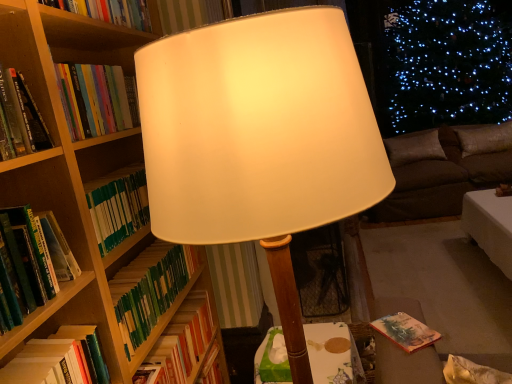
Describe the element at coordinates (333, 355) in the screenshot. I see `wooden table at center` at that location.

Identify the location of green hardcover book at left, which is the 2th book from top to bottom. (27, 255).

The width and height of the screenshot is (512, 384). What are the coordinates of `brown suede pillow at right, arranged as the 2th pillow when viewed from the right` in the screenshot? It's located at (414, 148).

The height and width of the screenshot is (384, 512). What do you see at coordinates (182, 343) in the screenshot?
I see `green matte book at left, which ranks as the 1th book in bottom-to-top order` at bounding box center [182, 343].

The height and width of the screenshot is (384, 512). What do you see at coordinates (260, 139) in the screenshot?
I see `matte white lampshade at center` at bounding box center [260, 139].

At what (x,y) coordinates should I click in order to perform the action: click on wooden table at center. Please return your answer as a coordinate pair (x, y). Looking at the image, I should click on (333, 355).

From the picture: Looking at their sizes, would you say brown fabric pillow at right, the first pillow positioned from the right, is wider or thinner than dark brown fabric couch at right?

Clearly, brown fabric pillow at right, the first pillow positioned from the right, has less width compared to dark brown fabric couch at right.

Which of these two, brown fabric pillow at right, the first pillow positioned from the right, or dark brown fabric couch at right, stands shorter?

With less height is brown fabric pillow at right, the first pillow positioned from the right.

From the image's perspective, between brown fabric pillow at right, marked as the 2th pillow in a left-to-right arrangement, and dark brown fabric couch at right, who is located below?

dark brown fabric couch at right, from the image's perspective.

Does brown suede pillow at right, arranged as the 2th pillow when viewed from the right, touch brown fabric pillow at right, marked as the 2th pillow in a left-to-right arrangement?

They are not placed beside each other.

Consider the image. From their relative heights in the image, would you say brown suede pillow at right, placed as the first pillow when sorted from left to right, is taller or shorter than brown fabric pillow at right, marked as the 2th pillow in a left-to-right arrangement?

Considering their sizes, brown suede pillow at right, placed as the first pillow when sorted from left to right, has more height than brown fabric pillow at right, marked as the 2th pillow in a left-to-right arrangement.

Identify the location of pillow on the right of brown suede pillow at right, arranged as the 2th pillow when viewed from the right. The width and height of the screenshot is (512, 384). (485, 139).

Which of these two, brown suede pillow at right, arranged as the 2th pillow when viewed from the right, or brown fabric pillow at right, the first pillow positioned from the right, is bigger?

With larger size is brown suede pillow at right, arranged as the 2th pillow when viewed from the right.

Is hardcover book at left, the 3th book viewed from the top, placed right next to hardcover book at upper left, which is the first book in top-to-bottom order?

No, hardcover book at left, the 3th book viewed from the top, is not in contact with hardcover book at upper left, which is the first book in top-to-bottom order.

Where is `the 2nd book below the hardcover book at upper left, the 4th book in the bottom-to-top sequence (from the image's perspective)`? the 2nd book below the hardcover book at upper left, the 4th book in the bottom-to-top sequence (from the image's perspective) is located at coordinates (59, 359).

What's the angular difference between hardcover book at left, the 3th book viewed from the top, and hardcover book at upper left, the 4th book in the bottom-to-top sequence,'s facing directions?

The facing directions of hardcover book at left, the 3th book viewed from the top, and hardcover book at upper left, the 4th book in the bottom-to-top sequence, are 0.00209 degrees apart.

From a real-world perspective, does wooden table at center stand above green hardcover book at left, which is the 3th book in bottom-to-top order?

No, from a real-world perspective, wooden table at center is not over green hardcover book at left, which is the 3th book in bottom-to-top order

Based on the photo, is wooden table at center positioned beyond the bounds of green hardcover book at left, which is the 3th book in bottom-to-top order?

Indeed, wooden table at center is completely outside green hardcover book at left, which is the 3th book in bottom-to-top order.

Who is bigger, wooden table at center or green hardcover book at left, which is the 3th book in bottom-to-top order?

With larger size is wooden table at center.

Is there a large distance between wooden table at center and green hardcover book at left, which is the 2th book from top to bottom?

wooden table at center is positioned a significant distance from green hardcover book at left, which is the 2th book from top to bottom.

From a real-world perspective, is matte white lampshade at center physically above green hardcover book at left, which is the 2th book from top to bottom?

No, from a real-world perspective, matte white lampshade at center is not above green hardcover book at left, which is the 2th book from top to bottom.

Is matte white lampshade at center oriented away from green hardcover book at left, which is the 2th book from top to bottom?

That's right, matte white lampshade at center is facing away from green hardcover book at left, which is the 2th book from top to bottom.

Considering the relative sizes of matte white lampshade at center and green hardcover book at left, which is the 3th book in bottom-to-top order, in the image provided, is matte white lampshade at center shorter than green hardcover book at left, which is the 3th book in bottom-to-top order,?

In fact, matte white lampshade at center may be taller than green hardcover book at left, which is the 3th book in bottom-to-top order.

Which is behind, point (331, 221) or point (19, 211)?

Point (19, 211)

From a real-world perspective, is brown suede pillow at right, placed as the first pillow when sorted from left to right, under green hardcover book at left, which is the 3th book in bottom-to-top order?

Yes.

Is brown suede pillow at right, placed as the first pillow when sorted from left to right, further to the viewer compared to green hardcover book at left, which is the 3th book in bottom-to-top order?

Yes.

Between brown suede pillow at right, placed as the first pillow when sorted from left to right, and green hardcover book at left, which is the 2th book from top to bottom, which one has larger width?

brown suede pillow at right, placed as the first pillow when sorted from left to right.

Which object is positioned more to the left, brown suede pillow at right, arranged as the 2th pillow when viewed from the right, or green hardcover book at left, which is the 2th book from top to bottom?

From the viewer's perspective, green hardcover book at left, which is the 2th book from top to bottom, appears more on the left side.

Looking at this image, do you think green hardcover book at left, which is the 3th book in bottom-to-top order, is within dark brown fabric couch at right, or outside of it?

green hardcover book at left, which is the 3th book in bottom-to-top order, lies outside dark brown fabric couch at right.

From the image's perspective, between green hardcover book at left, which is the 3th book in bottom-to-top order, and dark brown fabric couch at right, which one is located above?

dark brown fabric couch at right appears higher in the image.

Is green hardcover book at left, which is the 2th book from top to bottom, positioned with its back to dark brown fabric couch at right?

That's not correct — green hardcover book at left, which is the 2th book from top to bottom, is not looking away from dark brown fabric couch at right.

Who is shorter, green hardcover book at left, which is the 2th book from top to bottom, or dark brown fabric couch at right?

Standing shorter between the two is green hardcover book at left, which is the 2th book from top to bottom.

This screenshot has height=384, width=512. Find the location of `pillow that is the 1st one when counting backward from the dark brown fabric couch at right`. pillow that is the 1st one when counting backward from the dark brown fabric couch at right is located at coordinates (485, 139).

I want to click on pillow above the brown suede pillow at right, placed as the first pillow when sorted from left to right (from the image's perspective), so click(485, 139).

Which object lies nearer to the anchor point hardcover book at left, the 3th book viewed from the top, brown suede pillow at right, placed as the first pillow when sorted from left to right, or hardcover book at upper left, the 4th book in the bottom-to-top sequence?

hardcover book at upper left, the 4th book in the bottom-to-top sequence, lies closer to hardcover book at left, the 3th book viewed from the top, than the other object.

From the image, which object appears to be nearer to dark brown fabric couch at right, wooden table at center or green hardcover book at left, which is the 3th book in bottom-to-top order?

wooden table at center.

Estimate the real-world distances between objects in this image. Which object is further from dark brown fabric couch at right, hardcover book at upper left, the 4th book in the bottom-to-top sequence, or green hardcover book at left, which is the 2th book from top to bottom?

Among the two, green hardcover book at left, which is the 2th book from top to bottom, is located further to dark brown fabric couch at right.

Which object lies further to the anchor point dark brown fabric couch at right, brown suede pillow at right, arranged as the 2th pillow when viewed from the right, or matte white lampshade at center?

matte white lampshade at center lies further to dark brown fabric couch at right than the other object.

Which object lies further to the anchor point brown fabric pillow at right, the first pillow positioned from the right, hardcover book at left, which appears as the 2th book when ordered from the bottom, or hardcover book at upper left, the 4th book in the bottom-to-top sequence?

hardcover book at left, which appears as the 2th book when ordered from the bottom.

Considering their positions, is brown fabric pillow at right, the first pillow positioned from the right, positioned closer to dark brown fabric couch at right than green hardcover book at left, which is the 2th book from top to bottom?

brown fabric pillow at right, the first pillow positioned from the right.

Estimate the real-world distances between objects in this image. Which object is further from hardcover book at upper left, the 4th book in the bottom-to-top sequence, green matte book at left, which ranks as the 1th book in bottom-to-top order, or hardcover book at left, the 3th book viewed from the top?

green matte book at left, which ranks as the 1th book in bottom-to-top order, is positioned further to the anchor hardcover book at upper left, the 4th book in the bottom-to-top sequence.

Considering their positions, is green hardcover book at left, which is the 3th book in bottom-to-top order, positioned closer to green matte book at left, the fourth book when ordered from top to bottom, than brown fabric pillow at right, the first pillow positioned from the right?

green hardcover book at left, which is the 3th book in bottom-to-top order, lies closer to green matte book at left, the fourth book when ordered from top to bottom, than the other object.

At what (x,y) coordinates should I click in order to perform the action: click on table between matte white lampshade at center and dark brown fabric couch at right from front to back. Please return your answer as a coordinate pair (x, y). Looking at the image, I should click on (333, 355).

At what (x,y) coordinates should I click in order to perform the action: click on table between matte white lampshade at center and brown fabric pillow at right, the first pillow positioned from the right, from front to back. Please return your answer as a coordinate pair (x, y). The image size is (512, 384). Looking at the image, I should click on (333, 355).

Where is `book between hardcover book at left, the 3th book viewed from the top, and wooden table at center, in the horizontal direction`? The width and height of the screenshot is (512, 384). book between hardcover book at left, the 3th book viewed from the top, and wooden table at center, in the horizontal direction is located at coordinates (182, 343).

Locate an element on the screen. The height and width of the screenshot is (384, 512). couch positioned between green matte book at left, the fourth book when ordered from top to bottom, and brown suede pillow at right, arranged as the 2th pillow when viewed from the right, from near to far is located at coordinates (443, 170).